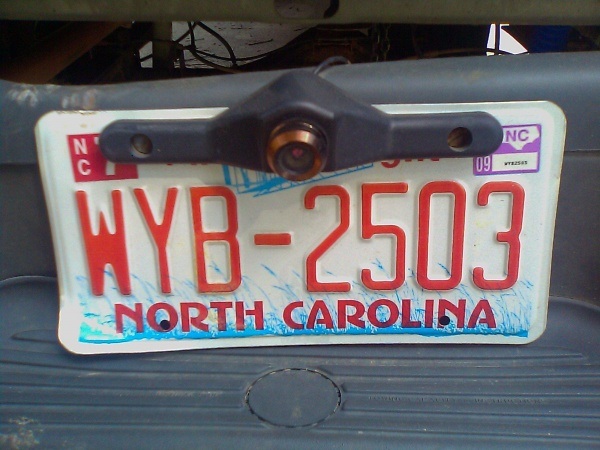
Where is `screws`? The height and width of the screenshot is (450, 600). screws is located at coordinates pyautogui.click(x=459, y=140), pyautogui.click(x=145, y=144).